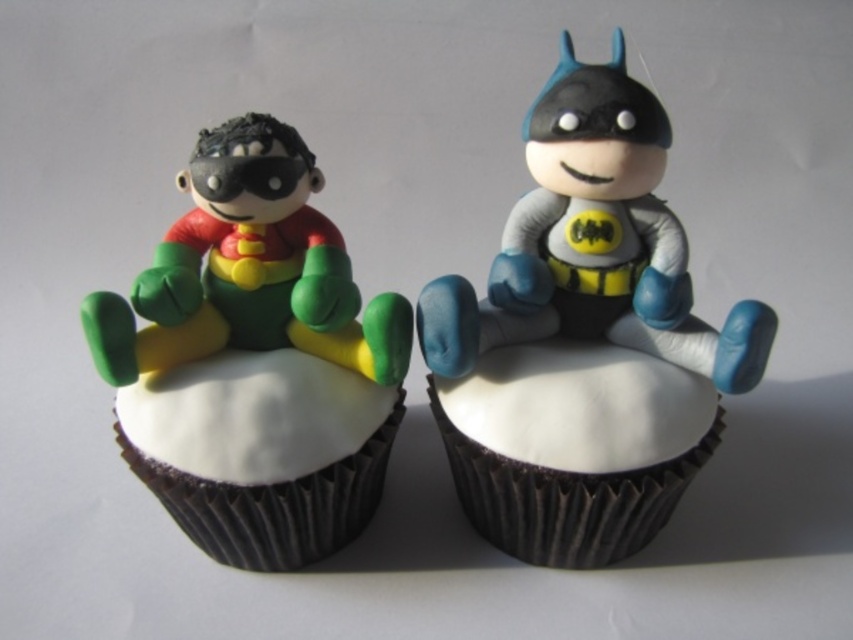
Is matte gray batman at center positioned at the back of matte green plastic toy at left?

Yes.

This screenshot has width=853, height=640. What do you see at coordinates (590, 340) in the screenshot? I see `matte gray batman at center` at bounding box center [590, 340].

Locate an element on the screen. matte gray batman at center is located at coordinates (590, 340).

Identify the location of matte gray batman at center. (590, 340).

What do you see at coordinates (590, 340) in the screenshot? I see `matte gray batman at center` at bounding box center [590, 340].

Between matte gray batman at center and white matte cupcake at center, which one appears on the right side from the viewer's perspective?

From the viewer's perspective, matte gray batman at center appears more on the right side.

What do you see at coordinates (590, 340) in the screenshot?
I see `matte gray batman at center` at bounding box center [590, 340].

What are the coordinates of `matte gray batman at center` in the screenshot? It's located at (590, 340).

Can you confirm if matte green plastic toy at left is shorter than white smooth cupcake at center?

Incorrect, matte green plastic toy at left's height does not fall short of white smooth cupcake at center's.

Where is `matte green plastic toy at left`? matte green plastic toy at left is located at coordinates (257, 355).